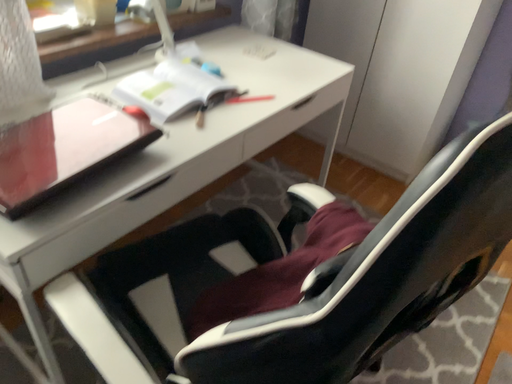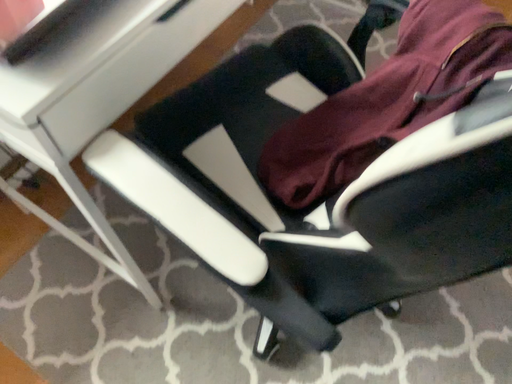
Question: How did the camera likely rotate when shooting the video?

Choices:
 (A) rotated downward
 (B) rotated upward

Answer: (A)